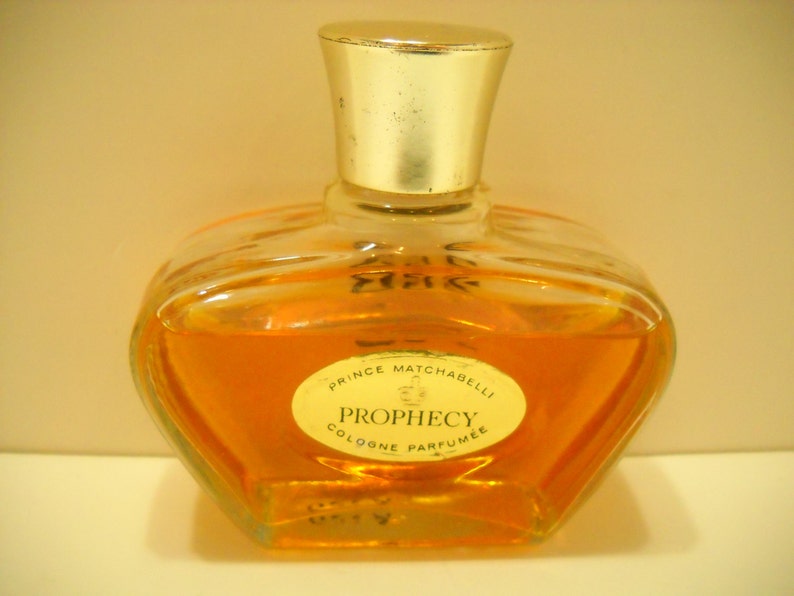
Image resolution: width=794 pixels, height=596 pixels. What are the coordinates of `perfume` in the screenshot? It's located at (564, 538).